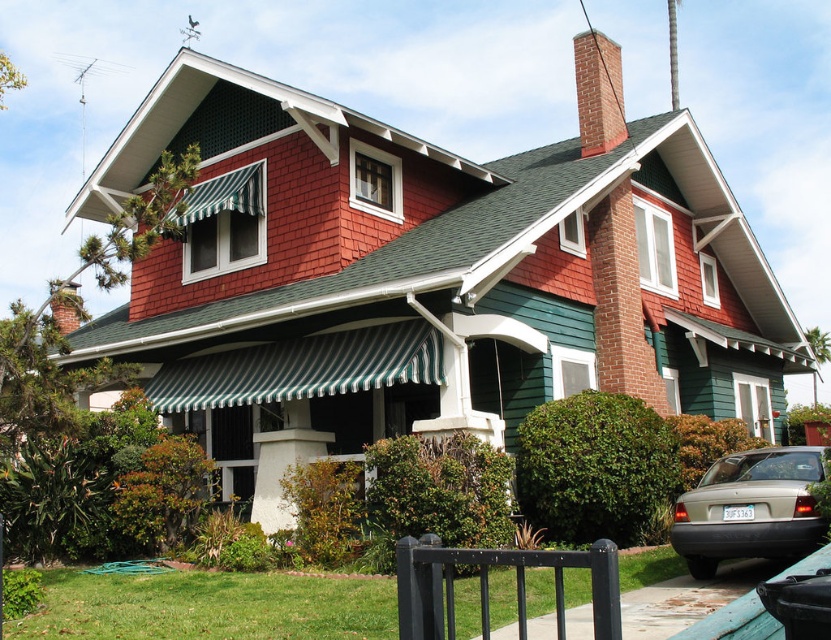
Question: Considering the relative positions of matte gray sedan at lower right and brick chimney at upper center in the image provided, where is matte gray sedan at lower right located with respect to brick chimney at upper center?

Choices:
 (A) left
 (B) right

Answer: (B)

Question: Is matte gray sedan at lower right wider than brick chimney at upper center?

Choices:
 (A) yes
 (B) no

Answer: (A)

Question: Which point is closer to the camera taking this photo?

Choices:
 (A) (750, 497)
 (B) (588, 116)

Answer: (A)

Question: Which of the following is the closest to the observer?

Choices:
 (A) matte gray sedan at lower right
 (B) brick chimney at upper center

Answer: (A)

Question: Can you confirm if matte gray sedan at lower right is positioned below brick chimney at upper center?

Choices:
 (A) no
 (B) yes

Answer: (B)